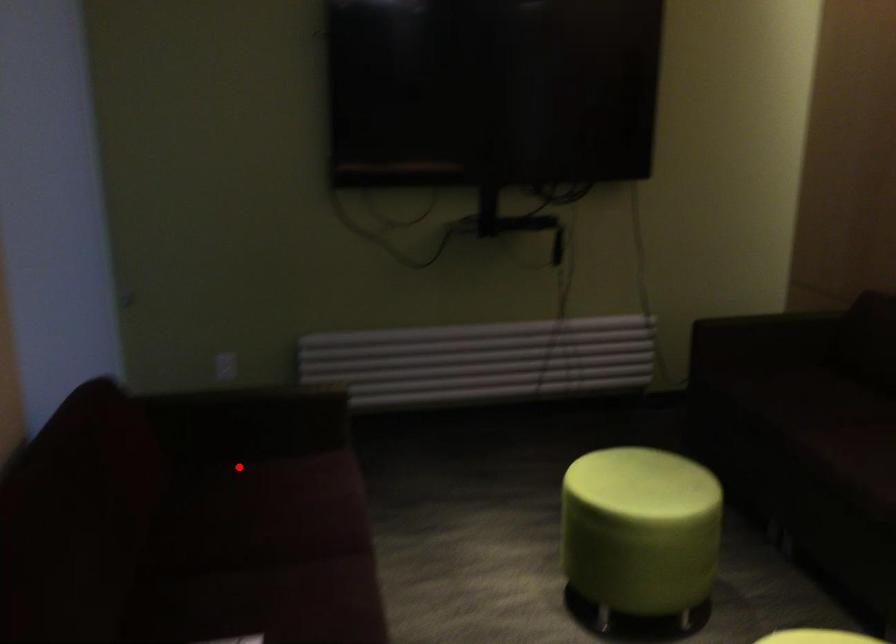
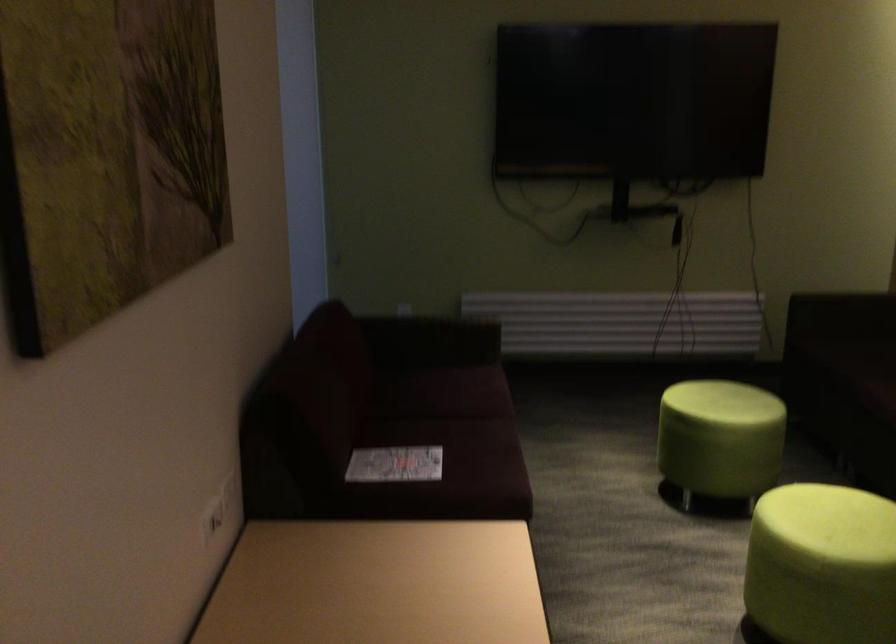
The point at the highlighted location is marked in the first image. Where is the corresponding point in the second image?

(426, 371)